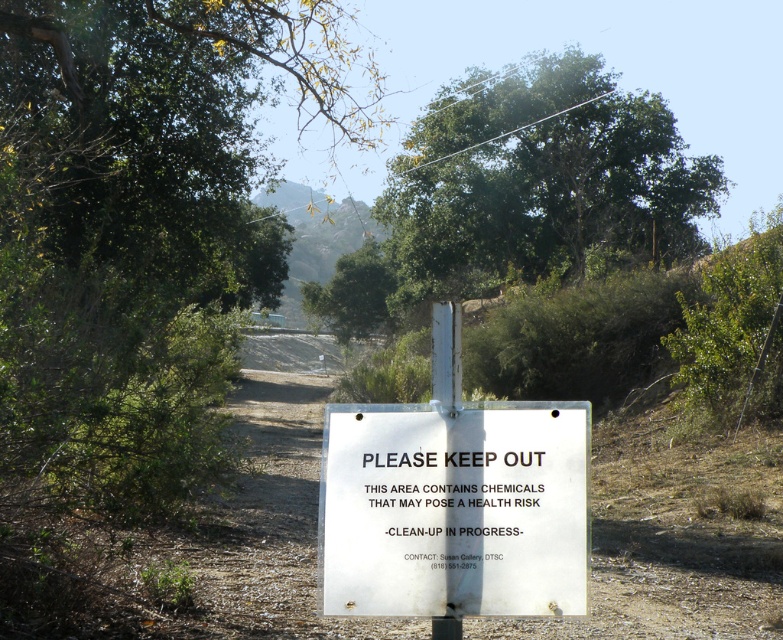
Which of these two, green leafy tree at upper center or white paper sign at center, stands shorter?

white paper sign at center is shorter.

Which is in front, point (675, 220) or point (478, 449)?

Point (478, 449)

Locate an element on the screen. The height and width of the screenshot is (640, 783). green leafy tree at upper center is located at coordinates (522, 195).

Image resolution: width=783 pixels, height=640 pixels. I want to click on green leafy tree at upper center, so click(522, 195).